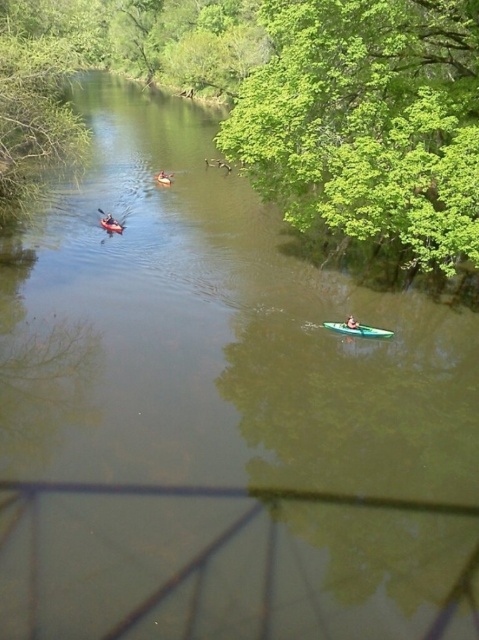
The height and width of the screenshot is (640, 479). Find the location of `orange plastic canoe at center`. orange plastic canoe at center is located at coordinates (111, 225).

How much distance is there between orange plastic canoe at center and orange kayak at center?

orange plastic canoe at center is 2.05 inches away from orange kayak at center.

What do you see at coordinates (111, 225) in the screenshot?
I see `orange plastic canoe at center` at bounding box center [111, 225].

This screenshot has height=640, width=479. In order to click on orange plastic canoe at center in this screenshot , I will do `click(111, 225)`.

Is green leafy tree at upper right positioned before green plastic kayak at lower right?

That is True.

From the picture: Who is shorter, green leafy tree at upper right or green plastic kayak at lower right?

green plastic kayak at lower right is shorter.

Does point (468, 92) come farther from viewer compared to point (352, 316)?

That is False.

Identify the location of green leafy tree at upper right. (368, 122).

Who is more distant from viewer, (264, 88) or (113, 225)?

The point (113, 225) is behind.

Between point (466, 202) and point (107, 228), which one is positioned behind?

Point (107, 228)

You are a GUI agent. You are given a task and a screenshot of the screen. Output one action in this format:
    pyautogui.click(x=<x>, y=<y>)
    Task: Click on the green leafy tree at upper right
    
    Given the screenshot: What is the action you would take?
    pyautogui.click(x=368, y=122)